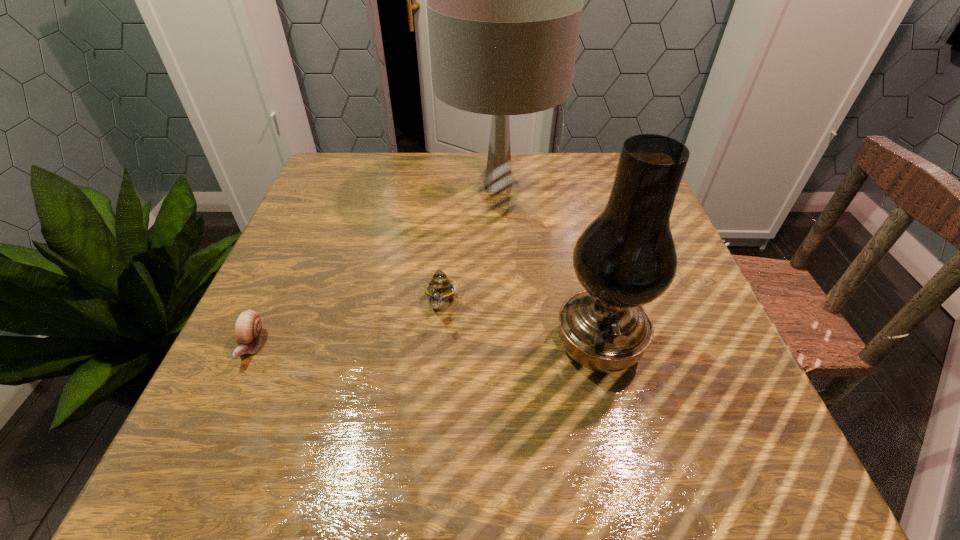
This screenshot has height=540, width=960. I want to click on vacant area situated on the face of the taller escargot, so 427,475.

Where is `free spot located 0.110m on the front-facing side of the left escargot`? This screenshot has height=540, width=960. free spot located 0.110m on the front-facing side of the left escargot is located at coordinates (210, 433).

Image resolution: width=960 pixels, height=540 pixels. In order to click on object that is at the far edge in this screenshot , I will do `click(504, 2)`.

Where is `object that is at the left edge`? The height and width of the screenshot is (540, 960). object that is at the left edge is located at coordinates (248, 328).

Locate an element on the screen. The height and width of the screenshot is (540, 960). object at the right edge is located at coordinates [626, 257].

Where is `free space at the far edge of the desktop`? free space at the far edge of the desktop is located at coordinates (567, 176).

I want to click on free space at the near edge of the desktop, so click(x=554, y=462).

The height and width of the screenshot is (540, 960). In order to click on vacant point at the left edge in this screenshot , I will do `click(260, 373)`.

Identify the location of vacant space at the right edge of the desktop. The image size is (960, 540). (766, 422).

In the image, there is a desktop. At what (x,y) coordinates should I click in order to perform the action: click on free region at the far left corner. Please return your answer as a coordinate pair (x, y). Image resolution: width=960 pixels, height=540 pixels. Looking at the image, I should click on (332, 195).